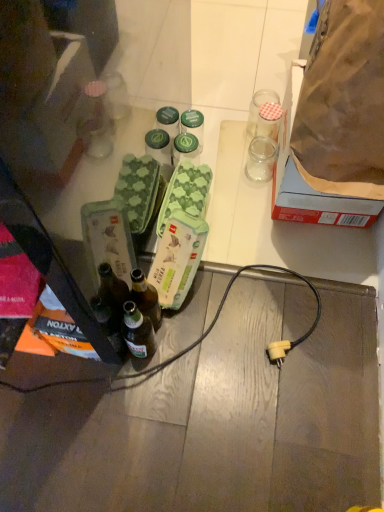
Question: Does green cardboard egg carton at center lie in front of green matte jar at center?

Choices:
 (A) yes
 (B) no

Answer: (A)

Question: Considering the relative sizes of green cardboard egg carton at center and green matte jar at center in the image provided, is green cardboard egg carton at center bigger than green matte jar at center?

Choices:
 (A) no
 (B) yes

Answer: (B)

Question: From the image's perspective, does green cardboard egg carton at center appear lower than green matte jar at center?

Choices:
 (A) yes
 (B) no

Answer: (A)

Question: Would you say green matte jar at center is part of green cardboard egg carton at center's contents?

Choices:
 (A) no
 (B) yes

Answer: (A)

Question: From a real-world perspective, is green cardboard egg carton at center located beneath green matte jar at center?

Choices:
 (A) no
 (B) yes

Answer: (A)

Question: Is green cardboard egg carton at center in contact with green matte jar at center?

Choices:
 (A) yes
 (B) no

Answer: (B)

Question: From the image's perspective, is clear glass jar at upper right, which is the 2th coffee cup in bottom-to-top order, located above green cardboard egg carton at center?

Choices:
 (A) yes
 (B) no

Answer: (A)

Question: Is clear glass jar at upper right, which is counted as the first coffee cup, starting from the top, smaller than green cardboard egg carton at center?

Choices:
 (A) no
 (B) yes

Answer: (B)

Question: Does clear glass jar at upper right, which is the 2th coffee cup in bottom-to-top order, have a larger size compared to green cardboard egg carton at center?

Choices:
 (A) yes
 (B) no

Answer: (B)

Question: Are clear glass jar at upper right, which is counted as the first coffee cup, starting from the top, and green cardboard egg carton at center far apart?

Choices:
 (A) no
 (B) yes

Answer: (A)

Question: Is clear glass jar at upper right, which is the 2th coffee cup in bottom-to-top order, to the left of green cardboard egg carton at center from the viewer's perspective?

Choices:
 (A) no
 (B) yes

Answer: (A)

Question: Does clear glass jar at upper right, which is the 2th coffee cup in bottom-to-top order, come in front of green cardboard egg carton at center?

Choices:
 (A) no
 (B) yes

Answer: (A)

Question: From a real-world perspective, is green matte jar at center located higher than brown paper bag at upper right?

Choices:
 (A) no
 (B) yes

Answer: (A)